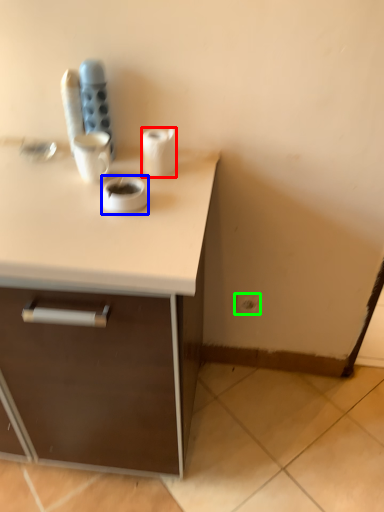
Question: Which object is the farthest from paper towel (highlighted by a red box)? Choose among these: coffee (highlighted by a blue box) or electric outlet (highlighted by a green box).

Choices:
 (A) coffee
 (B) electric outlet

Answer: (B)